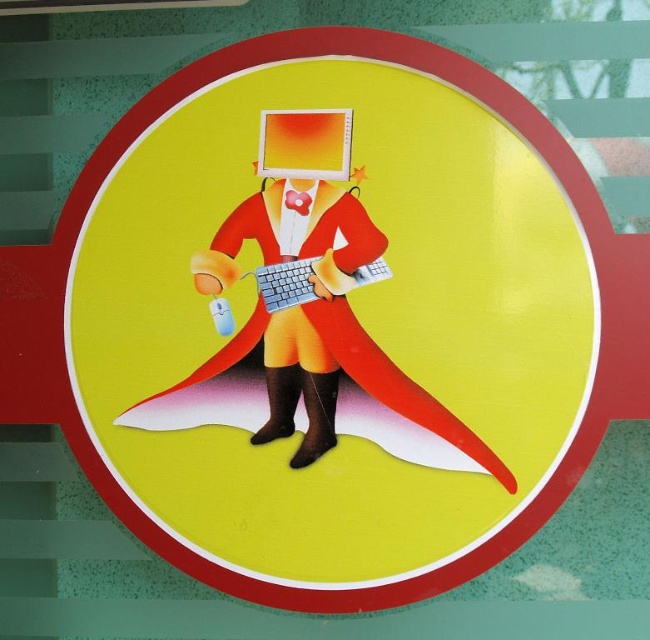
You are a delivery robot with a 25 cm wide box. You need to place the box between the matte orange laptop at center and the silver metallic keyboard at center. Is there enough space between them to fit the box?

The distance between the matte orange laptop at center and the silver metallic keyboard at center is 23.89 centimeters. Since the box is 25 cm wide, it is slightly wider than the available space. Therefore, the box cannot fit between them.